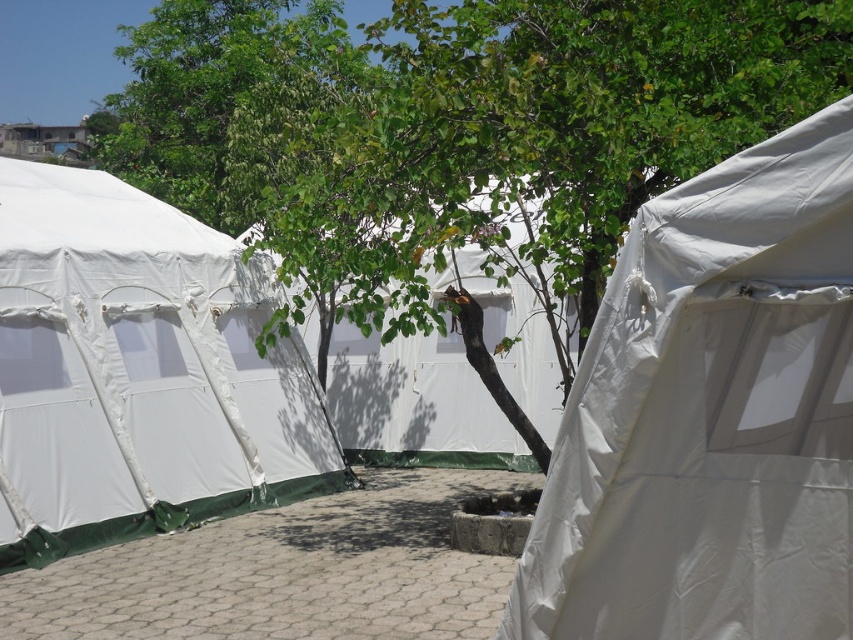
You are planning to set up a new tent in this area and need to know which existing tent is taller. Which one is taller between the white matte tent at center and the white fabric tent at left?

The white fabric tent at left is taller than the white matte tent at center.

You are planning to set up a picnic blanket between the green leafy tree at center and the white fabric tent at left. Based on their positions, will the picnic blanket be placed under the tree or under the tent?

The green leafy tree at center is located above the white fabric tent at left, so the picnic blanket placed between them would be under the tree.